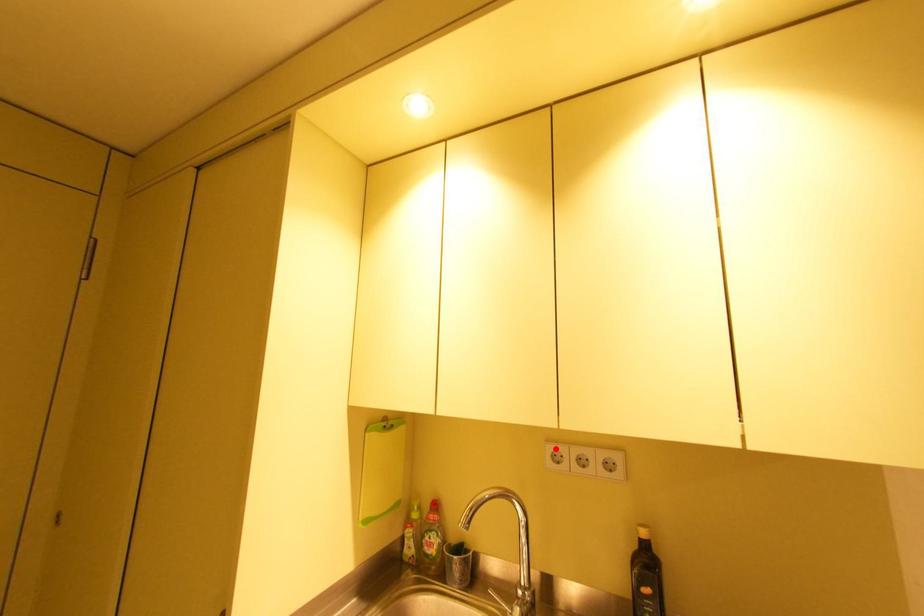
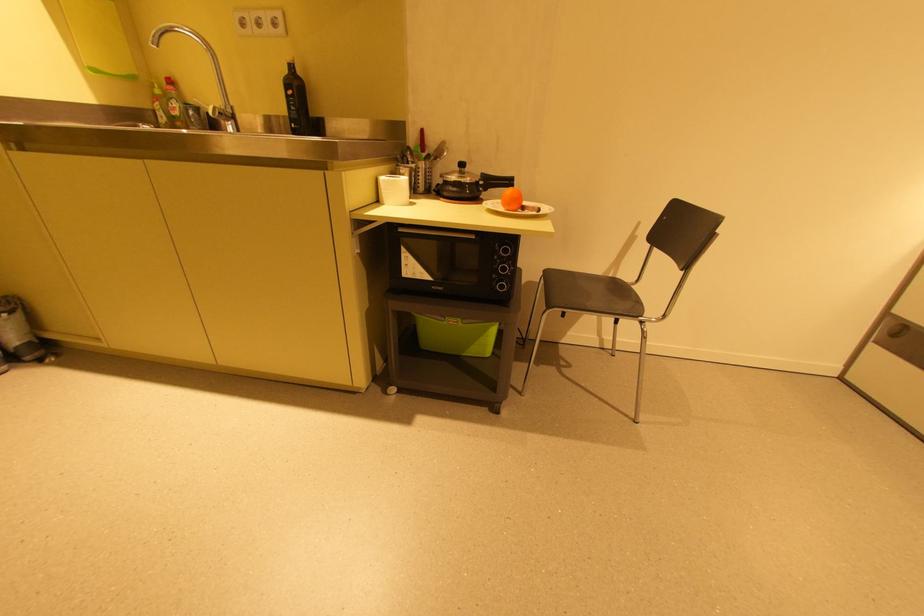
Find the pixel in the second image that matches the highlighted location in the first image.

(242, 17)